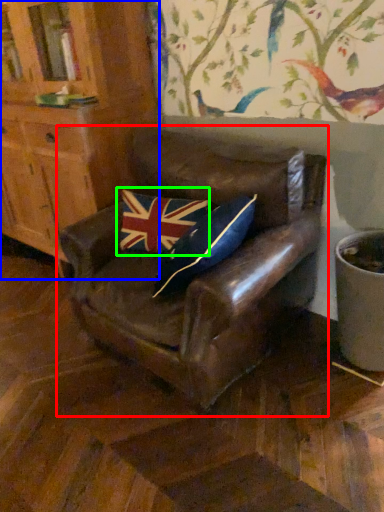
Question: Based on their relative distances, which object is farther from chair (highlighted by a red box)? Choose from cabinetry (highlighted by a blue box) and flag (highlighted by a green box).

Choices:
 (A) cabinetry
 (B) flag

Answer: (A)